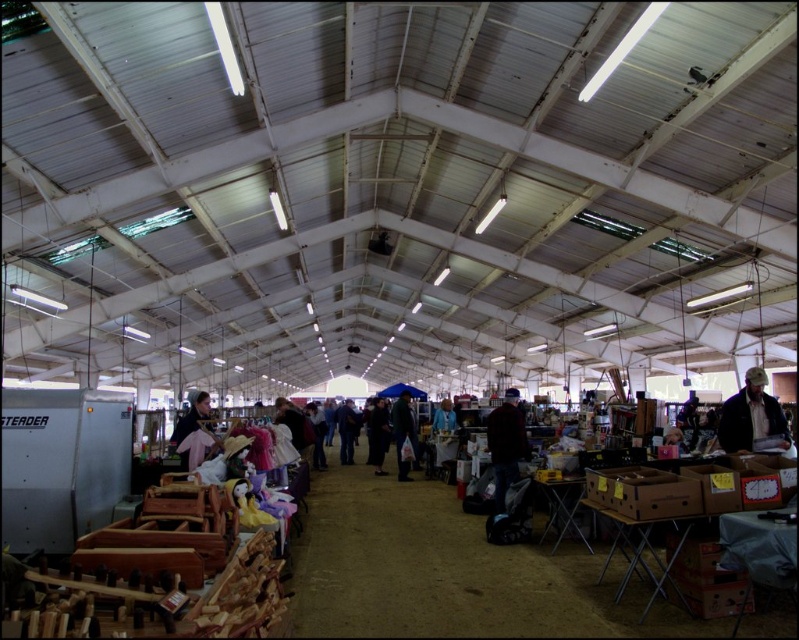
Which of these two, matte pink dress at left or dark gray fabric jacket at center, stands shorter?

matte pink dress at left

Which is in front, point (189, 456) or point (408, 396)?

Point (189, 456) is more forward.

Does point (209, 432) lie in front of point (396, 461)?

Yes.

This screenshot has width=799, height=640. I want to click on matte pink dress at left, so click(197, 433).

Is the position of matte pink dress at left less distant than that of dark blue jeans at center?

Yes.

Is point (189, 426) behind point (344, 406)?

No.

The width and height of the screenshot is (799, 640). I want to click on matte pink dress at left, so click(x=197, y=433).

Is matte pink dress at left positioned at the back of dark gray fabric coat at center?

No, matte pink dress at left is in front of dark gray fabric coat at center.

Does matte pink dress at left have a lesser height compared to dark gray fabric coat at center?

Correct, matte pink dress at left is not as tall as dark gray fabric coat at center.

The width and height of the screenshot is (799, 640). Describe the element at coordinates (197, 433) in the screenshot. I see `matte pink dress at left` at that location.

In order to click on matte pink dress at left in this screenshot , I will do `click(197, 433)`.